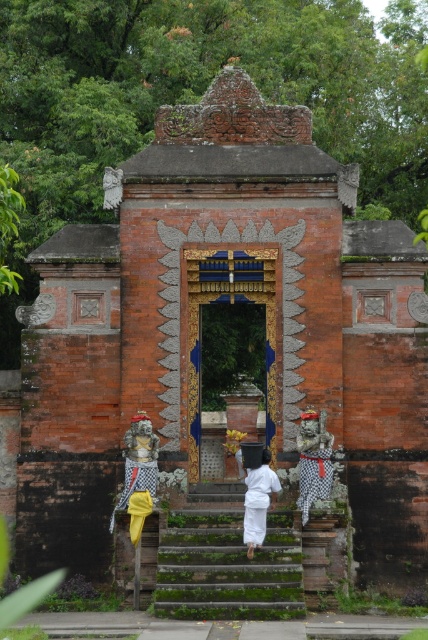
You are a visitor standing at the entrance of the temple. You want to touch the blue painted wood door at center. Considering the distance, is it possible for you to reach it without moving closer?

The blue painted wood door at center is 76.47 meters from viewer, so it is too far to reach without moving closer.

You are standing at the entrance of the Balinese temple and notice two points marked on the ground. The first point is at coordinates point (x=272, y=308) and the second is at point (x=314, y=452). Which point is closer to the entrance?

Point (x=314, y=452) is closer to the entrance because it is in front of point (x=272, y=308).

You are a visitor at the temple entrance. You notice the blue painted wood door at center and the white cotton kimono at center. Which one is larger in size?

The blue painted wood door at center is bigger than the white cotton kimono at center.